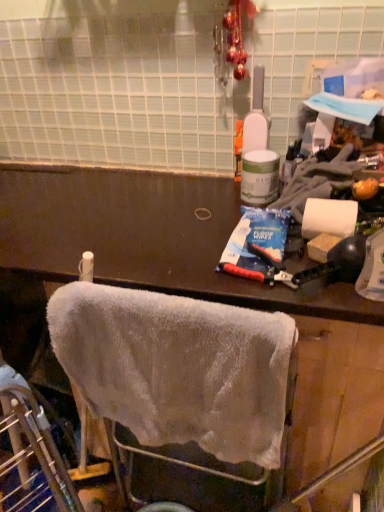
At what (x,y) coordinates should I click in order to perform the action: click on white fluffy towel at lower left. Please return your answer as a coordinate pair (x, y). The height and width of the screenshot is (512, 384). Looking at the image, I should click on (177, 367).

Describe the element at coordinates (177, 367) in the screenshot. I see `white fluffy towel at lower left` at that location.

You are a GUI agent. You are given a task and a screenshot of the screen. Output one action in this format:
    pyautogui.click(x=<x>, y=<y>)
    Task: Click on the white fluffy towel at lower left
    This screenshot has width=384, height=512.
    Given the screenshot: What is the action you would take?
    pyautogui.click(x=177, y=367)